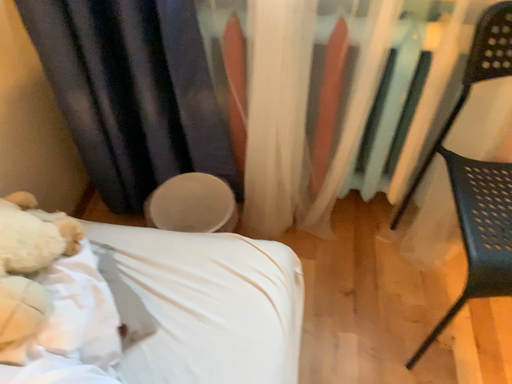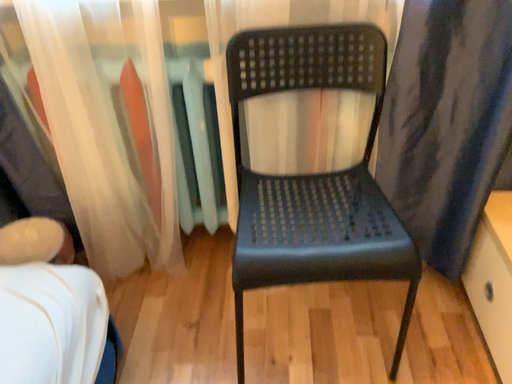
Question: How did the camera likely rotate when shooting the video?

Choices:
 (A) rotated downward
 (B) rotated upward

Answer: (B)